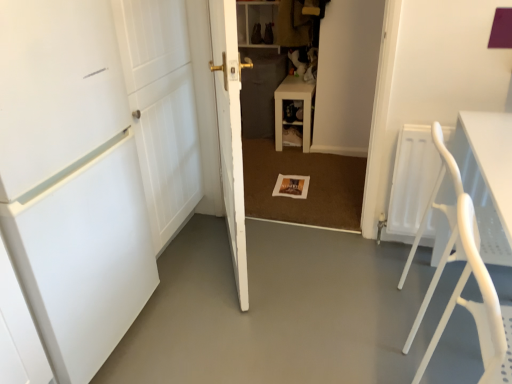
At what (x,y) coordinates should I click in order to perform the action: click on vacant space positioned to the left of white plastic folding chair at right. Please return your answer as a coordinate pair (x, y). The width and height of the screenshot is (512, 384). Looking at the image, I should click on pos(355,321).